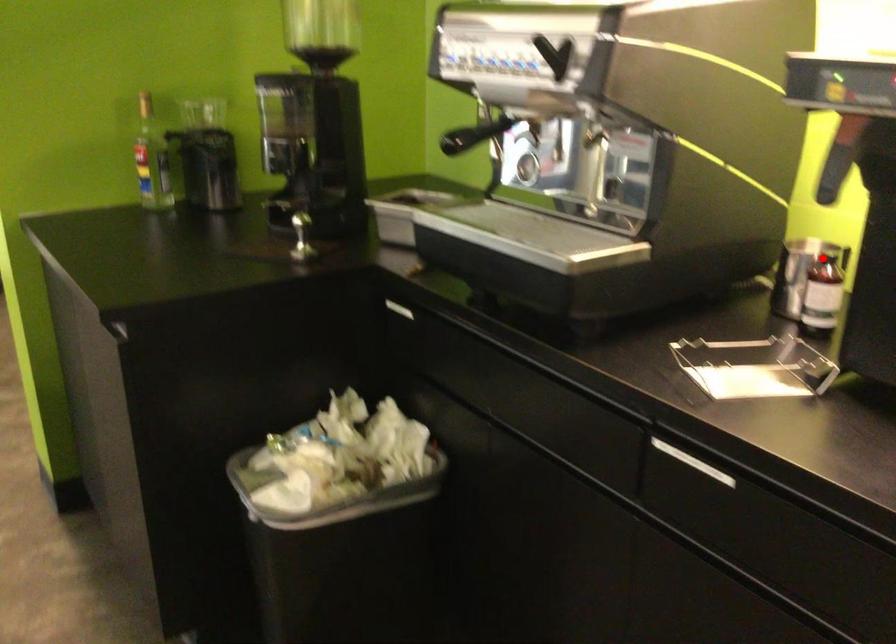
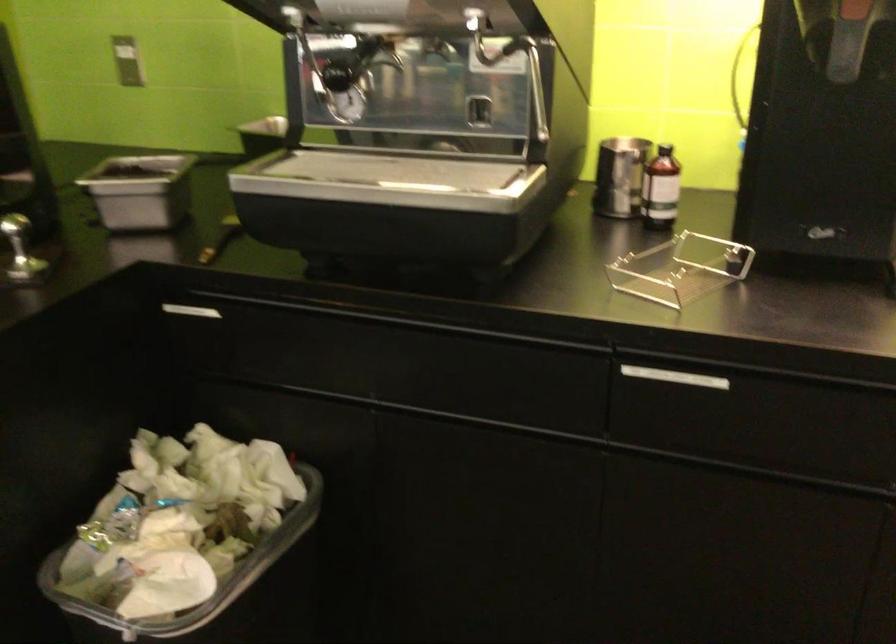
In the second image, find the point that corresponds to the highlighted location in the first image.

(666, 152)